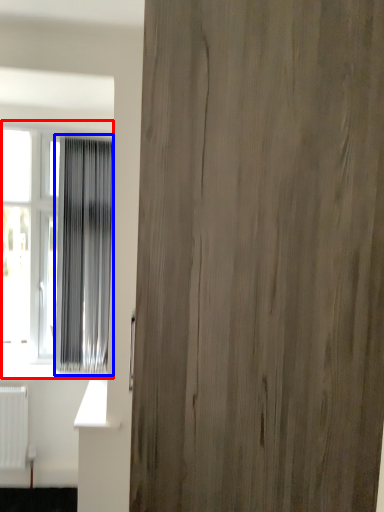
Question: Among these objects, which one is nearest to the camera, window (highlighted by a red box) or curtain (highlighted by a blue box)?

Choices:
 (A) window
 (B) curtain

Answer: (B)